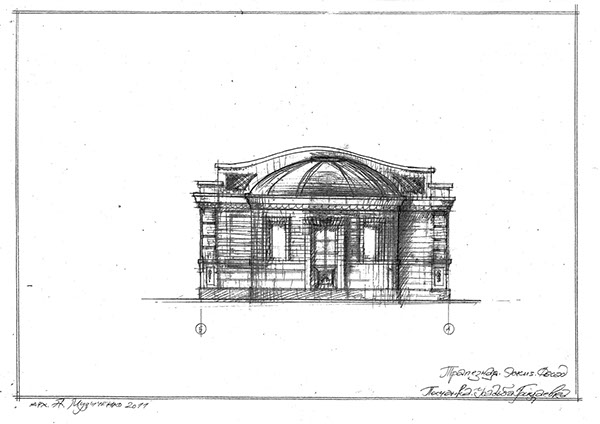
Locate an element on the screen. This screenshot has height=424, width=600. door is located at coordinates (315, 271).